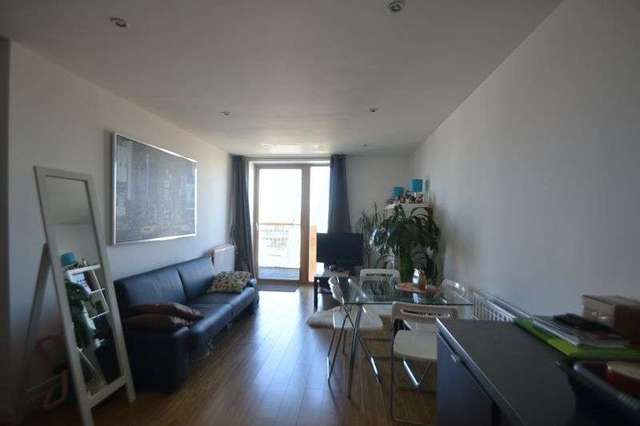
Find the location of a particular element. The width and height of the screenshot is (640, 426). lights is located at coordinates (226, 115), (374, 111).